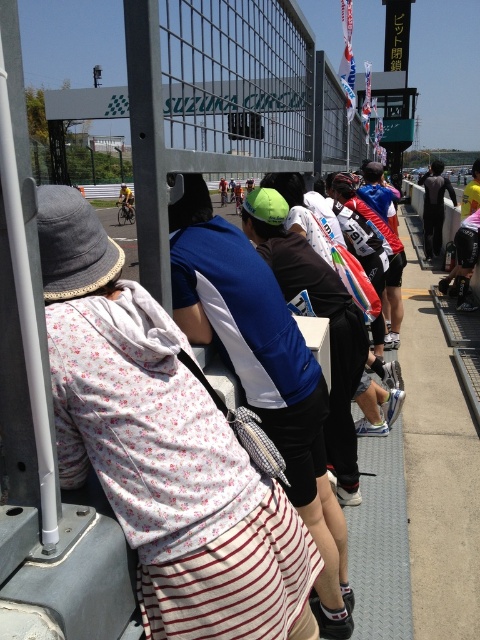
You are a photographer at the Suzuka Circuit event and want to capture both the floral fabric dress at center and the yellow jersey at center in your photo. However, you can only focus on one subject at a time. Which subject should you focus on to ensure the other is still visible in the background?

You should focus on the floral fabric dress at center because it is in front of the yellow jersey at center, so the yellow jersey at center will be visible in the background.

You are a spectator at the Suzuka Circuit event. You see a point marked at coordinates (434, 208). Based on the scene description, what object is this point located on?

The point at coordinates (434, 208) is located on the black matte wetsuit at center.